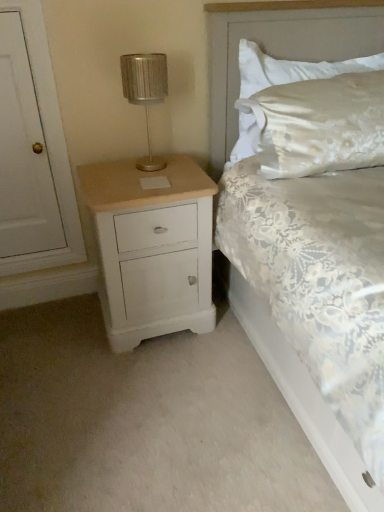
Find the location of `white painted wood chest of drawers at left`. white painted wood chest of drawers at left is located at coordinates (152, 248).

What is the approximate height of white lace bed at center?

It is 1.23 meters.

Find the location of `white painted wood door at left`. white painted wood door at left is located at coordinates (23, 154).

From a real-world perspective, which is physically above, white lace bed at center or metallic silver table lamp at upper left?

From a 3D spatial view, metallic silver table lamp at upper left is above.

Is white lace bed at center shorter than metallic silver table lamp at upper left?

In fact, white lace bed at center may be taller than metallic silver table lamp at upper left.

At what (x,y) coordinates should I click in order to perform the action: click on table lamp positioned vertically above the white lace bed at center (from a real-world perspective). Please return your answer as a coordinate pair (x, y). The height and width of the screenshot is (512, 384). Looking at the image, I should click on (145, 92).

From the image's perspective, is metallic silver table lamp at upper left located beneath white lace bed at center?

No.

Considering the sizes of metallic silver table lamp at upper left and white lace bed at center in the image, is metallic silver table lamp at upper left taller or shorter than white lace bed at center?

Clearly, metallic silver table lamp at upper left is shorter compared to white lace bed at center.

Who is more distant, metallic silver table lamp at upper left or white lace bed at center?

metallic silver table lamp at upper left is behind.

Considering the positions of point (24, 104) and point (147, 109), is point (24, 104) closer or farther from the camera than point (147, 109)?

Point (24, 104) appears to be closer to the viewer than point (147, 109).

How different are the orientations of white painted wood door at left and metallic silver table lamp at upper left in degrees?

The angular difference between white painted wood door at left and metallic silver table lamp at upper left is 1.04 degrees.

Consider the image. From a real-world perspective, relative to metallic silver table lamp at upper left, is white painted wood door at left vertically above or below?

In terms of real-world spatial position, white painted wood door at left is below metallic silver table lamp at upper left.

Is white lace bed at center placed right next to satin white pillow at upper right?

No, white lace bed at center is not touching satin white pillow at upper right.

The image size is (384, 512). Find the location of `bed in front of the satin white pillow at upper right`. bed in front of the satin white pillow at upper right is located at coordinates (282, 45).

Which of these two, white lace bed at center or satin white pillow at upper right, is wider?

With larger width is white lace bed at center.

Considering the positions of objects white lace bed at center and satin white pillow at upper right in the image provided, who is in front, white lace bed at center or satin white pillow at upper right?

white lace bed at center.

Considering the positions of objects white painted wood chest of drawers at left and white painted wood door at left in the image provided, who is more to the right, white painted wood chest of drawers at left or white painted wood door at left?

white painted wood chest of drawers at left.

Is white painted wood chest of drawers at left next to white painted wood door at left?

white painted wood chest of drawers at left is not next to white painted wood door at left, and they're not touching.

Based on the photo, considering the relative positions of white painted wood chest of drawers at left and white painted wood door at left in the image provided, is white painted wood chest of drawers at left behind white painted wood door at left?

No, it is in front of white painted wood door at left.

How different are the orientations of white painted wood chest of drawers at left and white painted wood door at left in degrees?

The angle between the facing direction of white painted wood chest of drawers at left and the facing direction of white painted wood door at left is 1.04 degrees.

Does white painted wood chest of drawers at left turn towards white lace bed at center?

No, white painted wood chest of drawers at left does not turn towards white lace bed at center.

Between white painted wood chest of drawers at left and white lace bed at center, which one appears on the left side from the viewer's perspective?

From the viewer's perspective, white painted wood chest of drawers at left appears more on the left side.

Considering the sizes of objects white painted wood chest of drawers at left and white lace bed at center in the image provided, who is wider, white painted wood chest of drawers at left or white lace bed at center?

Wider between the two is white lace bed at center.

Is the surface of white painted wood door at left in direct contact with satin white pillow at upper right?

white painted wood door at left is not next to satin white pillow at upper right, and they're not touching.

From a real-world perspective, which is physically above, white painted wood door at left or satin white pillow at upper right?

In real-world perspective, satin white pillow at upper right is above.

Can you confirm if white painted wood door at left is positioned to the right of satin white pillow at upper right?

No, white painted wood door at left is not to the right of satin white pillow at upper right.

Image resolution: width=384 pixels, height=512 pixels. Identify the location of bed on the right of metallic silver table lamp at upper left. pos(282,45).

I want to click on table lamp that appears behind the white lace bed at center, so click(145, 92).

Based on their spatial positions, is satin white pillow at upper right or metallic silver table lamp at upper left further from white painted wood door at left?

satin white pillow at upper right is further to white painted wood door at left.

Considering their positions, is metallic silver table lamp at upper left positioned further to white lace bed at center than white painted wood chest of drawers at left?

white painted wood chest of drawers at left.

Which object lies further to the anchor point satin white pillow at upper right, white painted wood chest of drawers at left or white lace bed at center?

white painted wood chest of drawers at left.

Considering their positions, is white lace bed at center positioned further to metallic silver table lamp at upper left than white painted wood door at left?

The object further to metallic silver table lamp at upper left is white painted wood door at left.

When comparing their distances from metallic silver table lamp at upper left, does white lace bed at center or white painted wood chest of drawers at left seem further?

white lace bed at center lies further to metallic silver table lamp at upper left than the other object.

Based on their spatial positions, is metallic silver table lamp at upper left or satin white pillow at upper right closer to white painted wood chest of drawers at left?

metallic silver table lamp at upper left.

When comparing their distances from white lace bed at center, does satin white pillow at upper right or white painted wood chest of drawers at left seem further?

white painted wood chest of drawers at left is positioned further to the anchor white lace bed at center.

Estimate the real-world distances between objects in this image. Which object is further from white painted wood chest of drawers at left, metallic silver table lamp at upper left or white painted wood door at left?

The object further to white painted wood chest of drawers at left is white painted wood door at left.

The width and height of the screenshot is (384, 512). In order to click on door between white lace bed at center and metallic silver table lamp at upper left along the z-axis in this screenshot , I will do `click(23, 154)`.

The height and width of the screenshot is (512, 384). I want to click on bed between white painted wood door at left and satin white pillow at upper right, so click(282, 45).

Where is `the chest of drawers positioned between white lace bed at center and satin white pillow at upper right from near to far`? Image resolution: width=384 pixels, height=512 pixels. the chest of drawers positioned between white lace bed at center and satin white pillow at upper right from near to far is located at coordinates (152, 248).

This screenshot has height=512, width=384. Identify the location of the chest of drawers located between white painted wood door at left and metallic silver table lamp at upper left in the left-right direction. (152, 248).